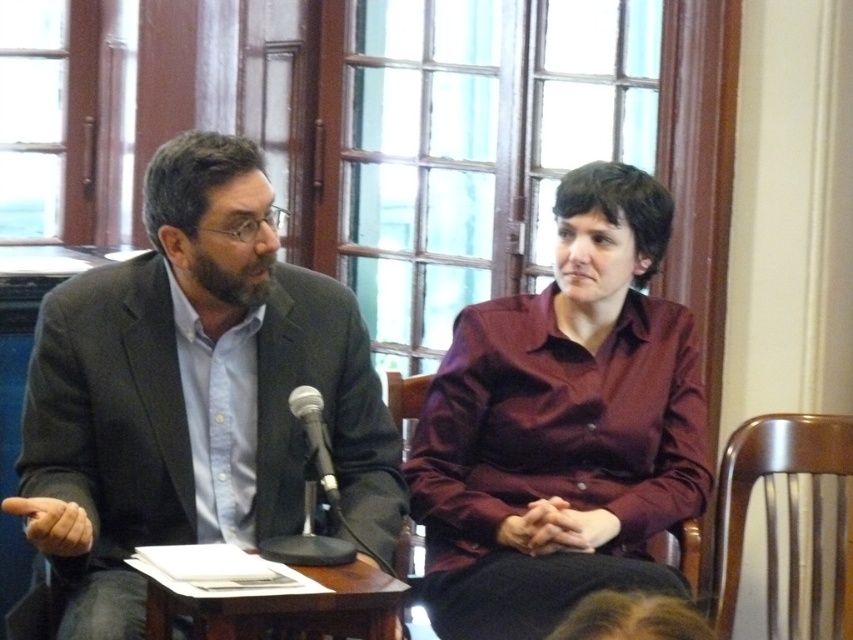
Question: Can you confirm if brown wooden table at center is bigger than wooden chair at center?

Choices:
 (A) yes
 (B) no

Answer: (A)

Question: Does wooden chair at right appear on the left side of black metallic microphone at center?

Choices:
 (A) no
 (B) yes

Answer: (A)

Question: Is matte black suit at left positioned before black metallic microphone at center?

Choices:
 (A) yes
 (B) no

Answer: (A)

Question: Which of the following is the closest to the observer?

Choices:
 (A) matte black suit at left
 (B) brown wooden table at center

Answer: (B)

Question: Which point appears closest to the camera in this image?

Choices:
 (A) (419, 376)
 (B) (325, 492)
 (C) (735, 481)
 (D) (234, 595)

Answer: (D)

Question: Among these objects, which one is nearest to the camera?

Choices:
 (A) black metallic microphone at center
 (B) wooden chair at right
 (C) wooden chair at center

Answer: (A)